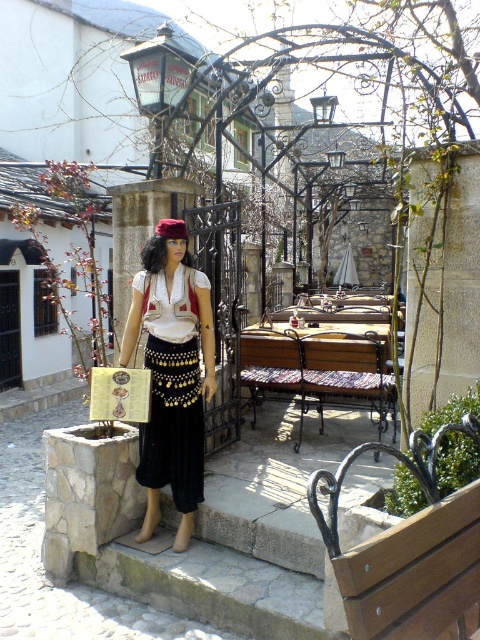
Based on the photo, who is shorter, matte black skirt at center or velvet red hat at center?

With less height is velvet red hat at center.

Where is `matte black skirt at center`? The width and height of the screenshot is (480, 640). matte black skirt at center is located at coordinates (171, 378).

Describe the element at coordinates (171, 378) in the screenshot. I see `matte black skirt at center` at that location.

Locate an element on the screen. This screenshot has height=640, width=480. matte black skirt at center is located at coordinates (171, 378).

Between matte black skirt at center and wooden bench at center, which one is positioned higher?

Positioned higher is matte black skirt at center.

In order to click on matte black skirt at center in this screenshot , I will do `click(171, 378)`.

Measure the distance between point (158, 346) and camera.

A distance of 4.23 meters exists between point (158, 346) and camera.

You are a GUI agent. You are given a task and a screenshot of the screen. Output one action in this format:
    pyautogui.click(x=<x>, y=<y>)
    Task: Click on the matte black skirt at center
    
    Given the screenshot: What is the action you would take?
    pyautogui.click(x=171, y=378)

Between wooden bench at center and velvet red hat at center, which one appears on the right side from the viewer's perspective?

Positioned to the right is wooden bench at center.

Where is `wooden bench at center`? Image resolution: width=480 pixels, height=640 pixels. wooden bench at center is located at coordinates (316, 372).

This screenshot has width=480, height=640. What are the coordinates of `wooden bench at center` in the screenshot? It's located at (316, 372).